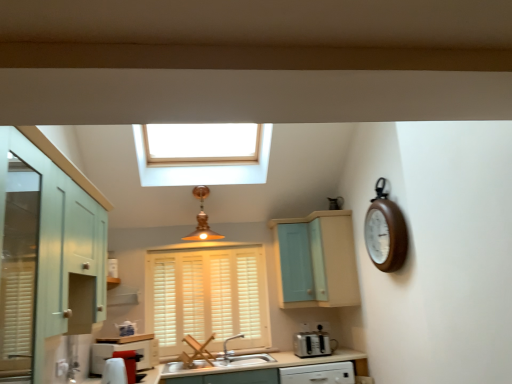
Question: Is copper metallic pendant light at center not near light blue wood cabinet at upper center?

Choices:
 (A) yes
 (B) no

Answer: (B)

Question: From the image's perspective, is copper metallic pendant light at center over light blue wood cabinet at upper center?

Choices:
 (A) yes
 (B) no

Answer: (A)

Question: Can you confirm if copper metallic pendant light at center is thinner than light blue wood cabinet at upper center?

Choices:
 (A) no
 (B) yes

Answer: (A)

Question: Is the position of copper metallic pendant light at center less distant than that of light blue wood cabinet at upper center?

Choices:
 (A) yes
 (B) no

Answer: (A)

Question: From the image's perspective, would you say copper metallic pendant light at center is shown under light blue wood cabinet at upper center?

Choices:
 (A) no
 (B) yes

Answer: (A)

Question: Is light blue wood cabinet at upper center a part of copper metallic pendant light at center?

Choices:
 (A) yes
 (B) no

Answer: (B)

Question: Is mint green wood cabinet at left, the 1th cabinetry when ordered from left to right, positioned beyond the bounds of white wood blinds at center?

Choices:
 (A) no
 (B) yes

Answer: (B)

Question: Is mint green wood cabinet at left, the first cabinetry positioned from the front, further to camera compared to white wood blinds at center?

Choices:
 (A) yes
 (B) no

Answer: (B)

Question: Is mint green wood cabinet at left, placed as the second cabinetry when sorted from right to left, oriented towards white wood blinds at center?

Choices:
 (A) yes
 (B) no

Answer: (B)

Question: Is white wood blinds at center at the back of mint green wood cabinet at left, the second cabinetry when ordered from back to front?

Choices:
 (A) yes
 (B) no

Answer: (B)

Question: Are mint green wood cabinet at left, the first cabinetry positioned from the front, and white wood blinds at center far apart?

Choices:
 (A) no
 (B) yes

Answer: (B)

Question: Does mint green wood cabinet at left, the 1th cabinetry when ordered from left to right, have a lesser height compared to white wood blinds at center?

Choices:
 (A) no
 (B) yes

Answer: (B)

Question: Considering the relative sizes of white wood blinds at center and wooden clock at right in the image provided, is white wood blinds at center smaller than wooden clock at right?

Choices:
 (A) no
 (B) yes

Answer: (A)